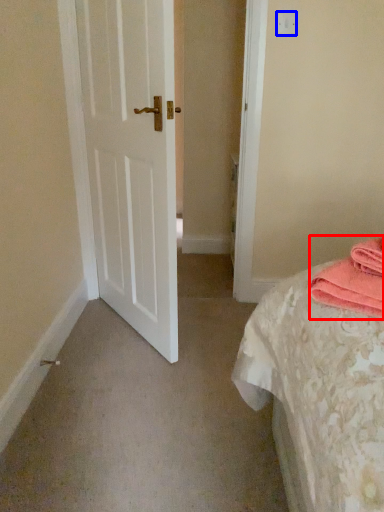
Question: Which object appears closest to the camera in this image, material (highlighted by a red box) or light switch (highlighted by a blue box)?

Choices:
 (A) material
 (B) light switch

Answer: (A)